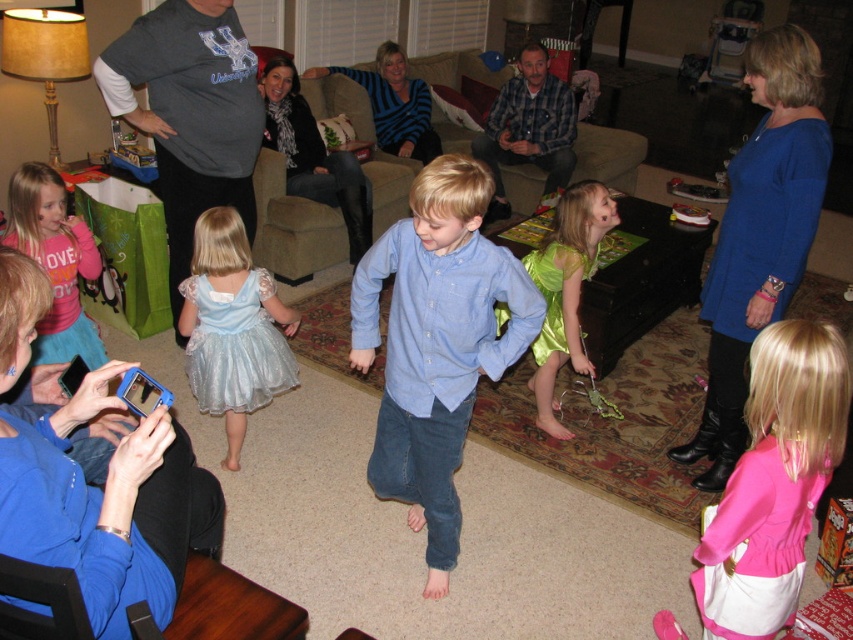
Is pink satin dress at lower right below shiny silver dress at lower left?

Correct, pink satin dress at lower right is located below shiny silver dress at lower left.

Which is more to the left, pink satin dress at lower right or shiny silver dress at lower left?

From the viewer's perspective, shiny silver dress at lower left appears more on the left side.

What do you see at coordinates (773, 481) in the screenshot? I see `pink satin dress at lower right` at bounding box center [773, 481].

Image resolution: width=853 pixels, height=640 pixels. I want to click on pink satin dress at lower right, so click(x=773, y=481).

Does blue denim shirt at center lie behind blue glitter dress at lower left?

That is True.

Which is in front, point (379, 474) or point (131, 364)?

Positioned in front is point (131, 364).

Identify the location of blue denim shirt at center. tap(436, 342).

Can you confirm if blue glitter dress at lower left is positioned to the left of pink satin dress at lower right?

Indeed, blue glitter dress at lower left is positioned on the left side of pink satin dress at lower right.

Where is `blue glitter dress at lower left`? This screenshot has width=853, height=640. blue glitter dress at lower left is located at coordinates (107, 506).